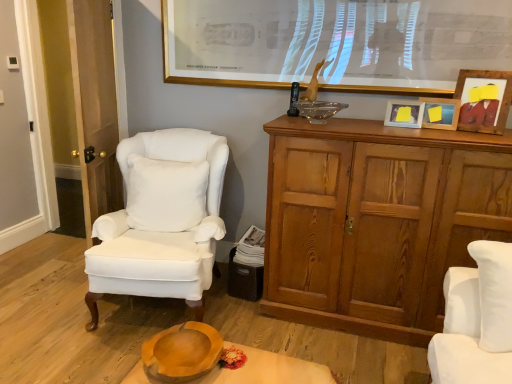
Where is `vacant area that is in front of transparent glass bowl at upper center`? Image resolution: width=512 pixels, height=384 pixels. vacant area that is in front of transparent glass bowl at upper center is located at coordinates (327, 121).